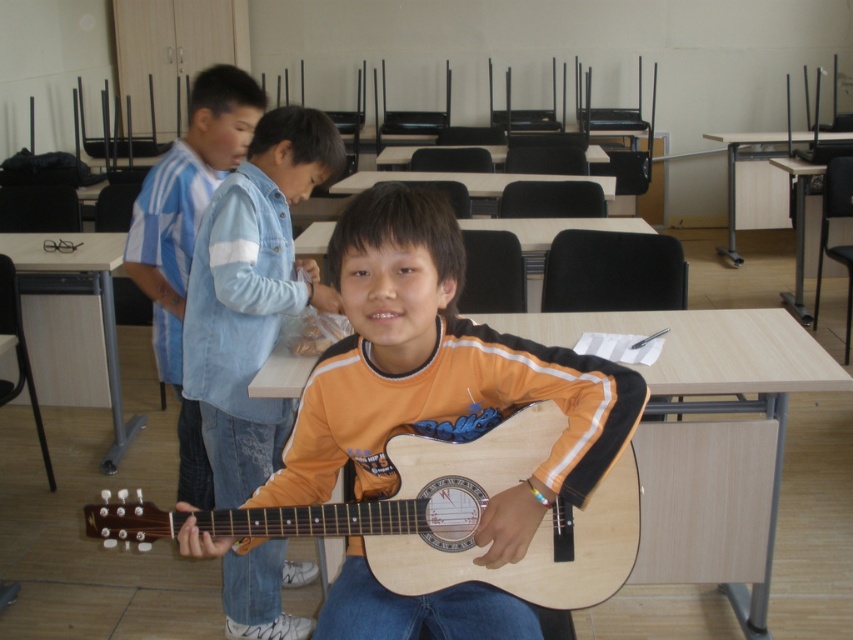
You are a student sitting at the desk in the classroom. You want to hand your teacher the wooden guitar at center and the orange matte guitar at center. Which guitar should you hand over first based on their positions?

You should hand over the wooden guitar at center first because it is closer to you than the orange matte guitar at center.

From the picture: You are a student in the classroom and you see the wooden guitar at center and the natural wood guitar at center. Which guitar is located to the right of the other?

The wooden guitar at center is positioned on the right side of natural wood guitar at center.